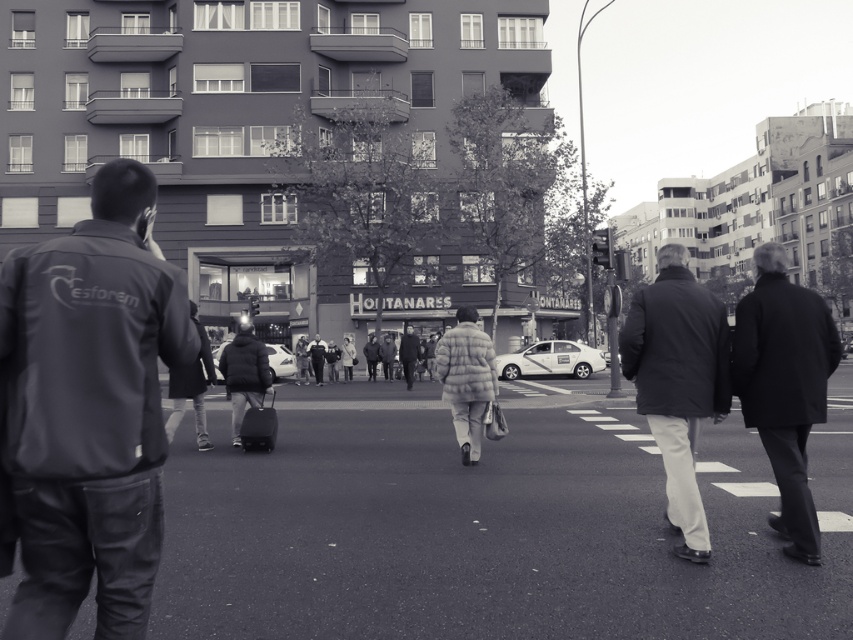
Question: Observing the image, what is the correct spatial positioning of dark gray jacket at left in reference to dark gray jacket at center?

Choices:
 (A) left
 (B) right

Answer: (A)

Question: Considering the relative positions of dark wool coat at right and dark gray jacket at center in the image provided, where is dark wool coat at right located with respect to dark gray jacket at center?

Choices:
 (A) right
 (B) left

Answer: (A)

Question: Among these points, which one is farthest from the camera?

Choices:
 (A) (128, 532)
 (B) (654, 387)
 (C) (764, 385)

Answer: (B)

Question: Which object is closer to the camera taking this photo?

Choices:
 (A) light gray puffer jacket at center
 (B) dark gray jacket at center
 (C) dark gray jacket at left

Answer: (C)

Question: Considering the relative positions of dark gray jacket at center and light gray puffer jacket at center in the image provided, where is dark gray jacket at center located with respect to light gray puffer jacket at center?

Choices:
 (A) left
 (B) right

Answer: (B)

Question: Which object is the closest to the dark gray jacket at center?

Choices:
 (A) light gray puffer jacket at center
 (B) dark gray jacket at left
 (C) dark wool coat at right

Answer: (C)